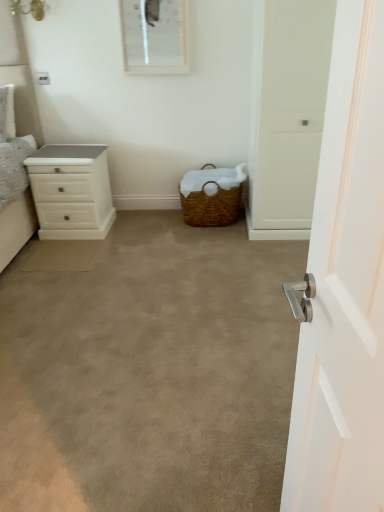
This screenshot has width=384, height=512. I want to click on vacant area that lies in front of white glossy chest of drawers at left, so click(x=76, y=250).